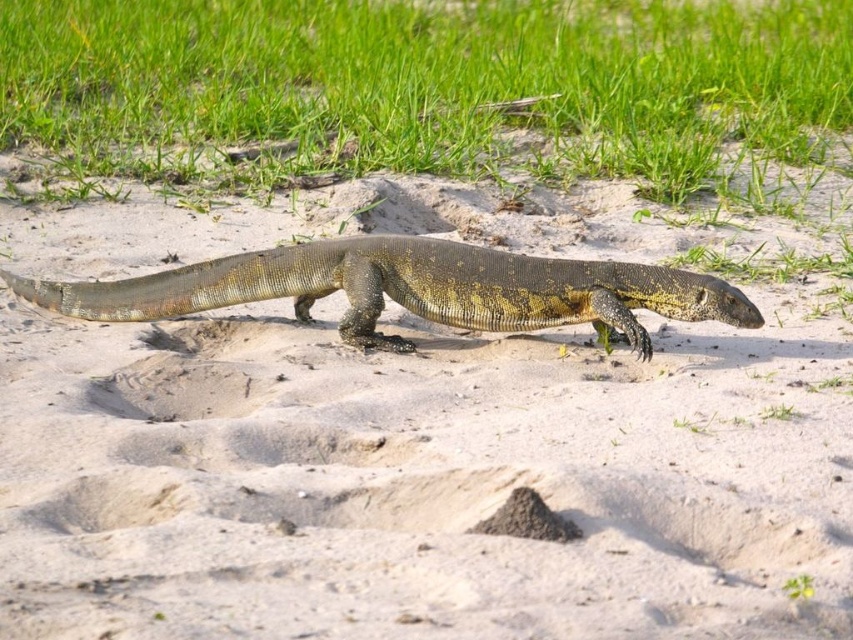
You are a hiker trying to determine the safest path across the sandy terrain. You notice the green grass at upper center and the brown scaly lizard at center. Which object has a narrower width, and should you avoid stepping on it to prevent damage?

The green grass at upper center has a lesser width compared to the brown scaly lizard at center. You should avoid stepping on the green grass at upper center since it is narrower and more fragile.

You are a hiker who wants to take a photo of the brown scaly lizard at center without getting too close. Since the green grass at upper center is blocking part of your view, can you move to the left or right to get a clearer shot?

The brown scaly lizard at center is behind green grass at upper center, so moving to the left or right might help you get a clearer view by positioning yourself around the obstruction caused by the green grass at upper center.